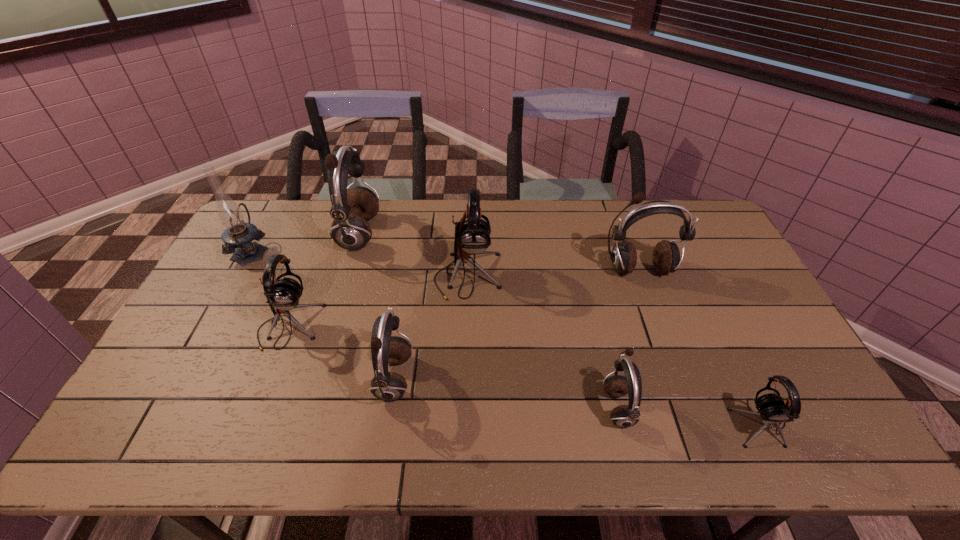
Where is `the biggest brown earphone`? Image resolution: width=960 pixels, height=540 pixels. the biggest brown earphone is located at coordinates (351, 209).

You are a GUI agent. You are given a task and a screenshot of the screen. Output one action in this format:
    pyautogui.click(x=<x>, y=<y>)
    Task: Click on the tallest earphone
    The width and height of the screenshot is (960, 540).
    Given the screenshot: What is the action you would take?
    pyautogui.click(x=351, y=209)

I want to click on oil lamp, so click(238, 235).

You are a GUI agent. You are given a task and a screenshot of the screen. Output one action in this format:
    pyautogui.click(x=<x>, y=<y>)
    Task: Click on the second black earphone from left to right
    
    Given the screenshot: What is the action you would take?
    pyautogui.click(x=472, y=235)

I want to click on the biggest black earphone, so click(x=472, y=235).

This screenshot has height=540, width=960. What are the coordinates of `the second biggest brown earphone` in the screenshot? It's located at (666, 259).

The height and width of the screenshot is (540, 960). I want to click on the second nearest black earphone, so click(283, 294).

The height and width of the screenshot is (540, 960). Identify the location of the second smallest black earphone. (283, 294).

At what (x,y) coordinates should I click in order to perform the action: click on the second smallest brown earphone. Please return your answer as a coordinate pair (x, y). The width and height of the screenshot is (960, 540). Looking at the image, I should click on (388, 386).

The height and width of the screenshot is (540, 960). What are the coordinates of `the fourth object from left to right` in the screenshot? It's located at (388, 386).